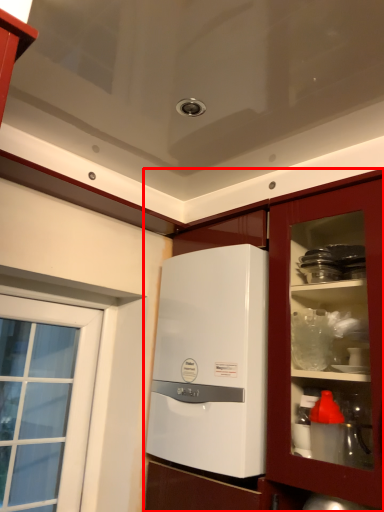
Question: Observing the image, what is the correct spatial positioning of cabinetry (annotated by the red box) in reference to home appliance?

Choices:
 (A) left
 (B) right

Answer: (A)